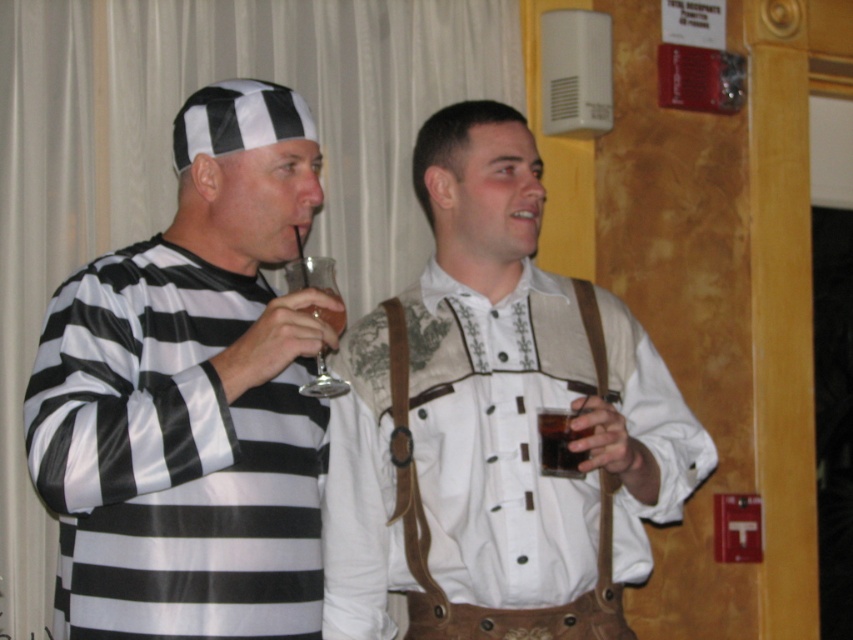
Question: Does clear glass wine glass at center have a smaller size compared to dark brown liquid at right?

Choices:
 (A) yes
 (B) no

Answer: (B)

Question: Which point is farther from the camera taking this photo?

Choices:
 (A) (572, 442)
 (B) (569, 433)
 (C) (321, 380)

Answer: (B)

Question: Does clear glass wine glass at center lie behind dark brown liquid at right?

Choices:
 (A) yes
 (B) no

Answer: (B)

Question: Which object is the farthest from the clear glass wine glass at center?

Choices:
 (A) dark brown liquid at right
 (B) translucent glass at upper center
 (C) white leather suspenders at center
 (D) matte black and white striped shirt at left

Answer: (C)

Question: Which of the following is the closest to the observer?

Choices:
 (A) (305, 282)
 (B) (560, 422)
 (C) (329, 292)

Answer: (C)

Question: Can you confirm if white leather suspenders at center is thinner than translucent glass at upper center?

Choices:
 (A) yes
 (B) no

Answer: (B)